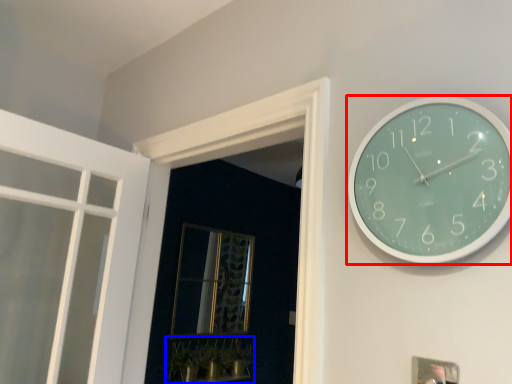
Question: Which of the following is the farthest to the observer, wall clock (highlighted by a red box) or plant (highlighted by a blue box)?

Choices:
 (A) wall clock
 (B) plant

Answer: (B)